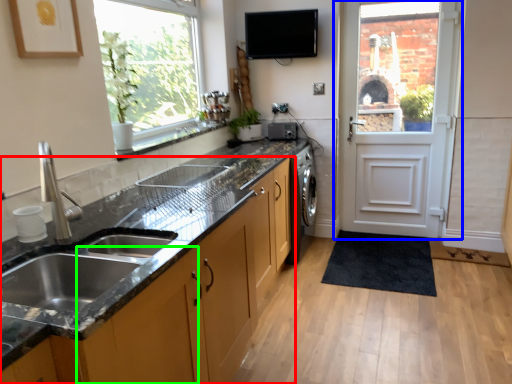
Question: Which object is positioned closest to cabinetry (highlighted by a red box)? Select from door (highlighted by a blue box) and cabinetry (highlighted by a green box).

Choices:
 (A) door
 (B) cabinetry

Answer: (B)